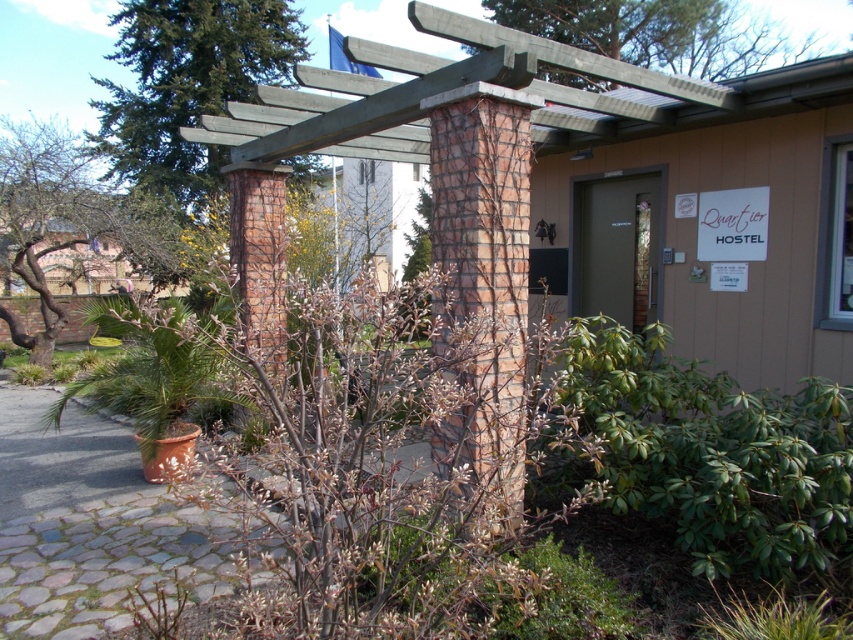
Question: Is the position of green textured tree at upper left more distant than that of green leafy tree at upper center?

Choices:
 (A) yes
 (B) no

Answer: (A)

Question: Which object is positioned closest to the green textured tree at upper left?

Choices:
 (A) green leafy tree at left
 (B) brown cobblestone path at center
 (C) green leafy tree at upper center

Answer: (A)

Question: Is brown cobblestone path at center positioned in front of green textured tree at upper left?

Choices:
 (A) no
 (B) yes

Answer: (B)

Question: Is brown cobblestone path at center thinner than green leafy tree at left?

Choices:
 (A) no
 (B) yes

Answer: (A)

Question: Which of the following is the closest to the observer?

Choices:
 (A) brown cobblestone path at center
 (B) green textured tree at upper left
 (C) green leafy tree at upper center
 (D) green leafy tree at left

Answer: (A)

Question: Which object appears closest to the camera in this image?

Choices:
 (A) green leafy tree at left
 (B) brown cobblestone path at center
 (C) green leafy tree at upper center
 (D) green textured tree at upper left

Answer: (B)